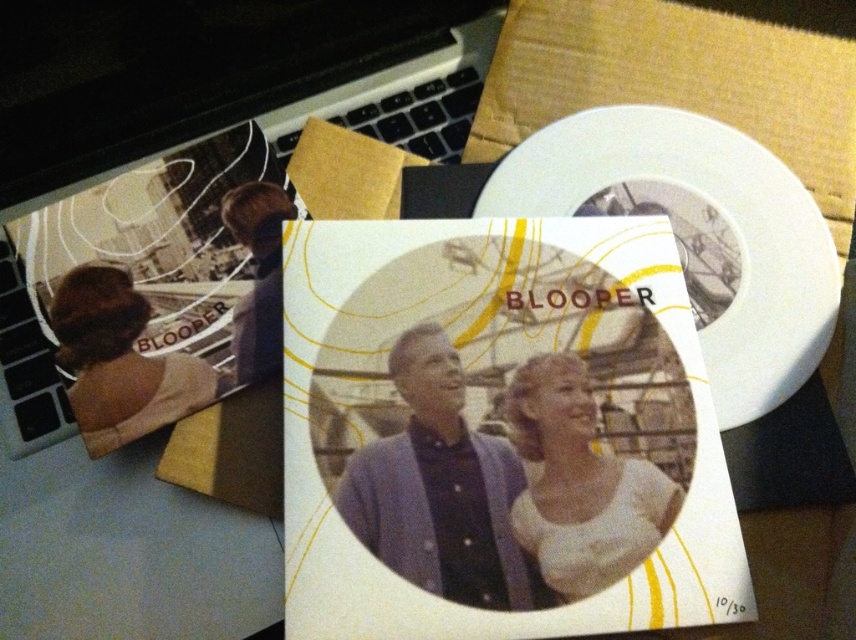
Question: Which point is closer to the camera?

Choices:
 (A) (424, 552)
 (B) (635, 506)

Answer: (A)

Question: Can you confirm if silver metallic laptop at upper center is positioned above purple fabric at center?

Choices:
 (A) yes
 (B) no

Answer: (A)

Question: Where is silver metallic laptop at upper center located in relation to purple fabric at center in the image?

Choices:
 (A) above
 (B) below

Answer: (A)

Question: Which object is the farthest from the matte white postcard at center?

Choices:
 (A) purple fabric at center
 (B) silver metallic laptop at upper center
 (C) matte brown hair at upper left

Answer: (C)

Question: In this image, where is matte white postcard at center located relative to white matte shirt at center?

Choices:
 (A) right
 (B) left

Answer: (B)

Question: Considering the real-world distances, which object is closest to the matte brown hair at upper left?

Choices:
 (A) purple fabric at center
 (B) silver metallic laptop at upper center
 (C) matte white postcard at center

Answer: (B)